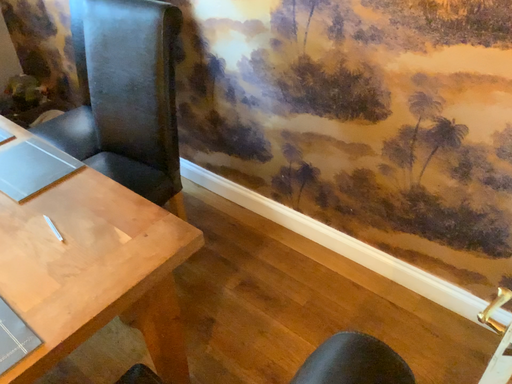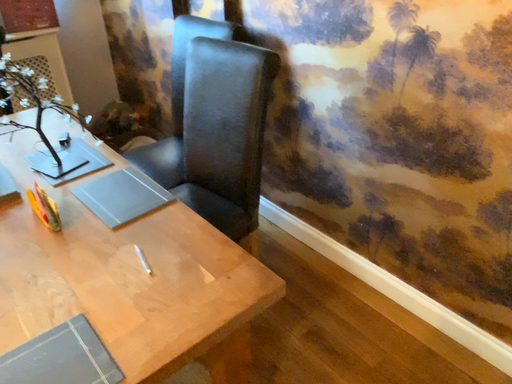
Question: How did the camera likely rotate when shooting the video?

Choices:
 (A) rotated right
 (B) rotated left

Answer: (B)